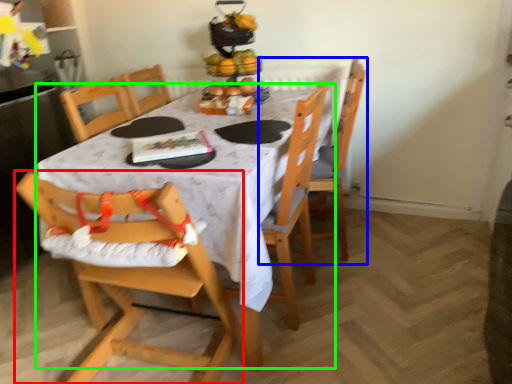
Question: Which object is positioned closest to chair (highlighted by a red box)? Select from chair (highlighted by a blue box) and table (highlighted by a green box).

Choices:
 (A) chair
 (B) table

Answer: (B)